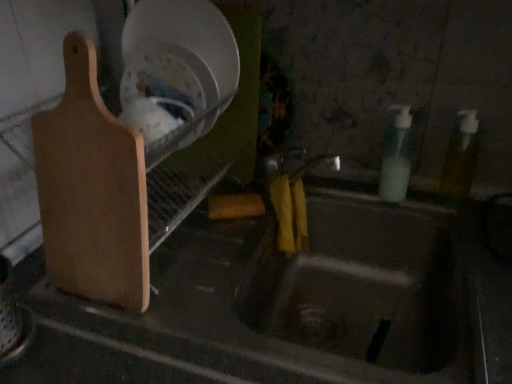
Question: From the image's perspective, is metallic sink at center on light brown wood cutting board at left?

Choices:
 (A) no
 (B) yes

Answer: (A)

Question: Does metallic sink at center appear on the left side of light brown wood cutting board at left?

Choices:
 (A) yes
 (B) no

Answer: (B)

Question: From a real-world perspective, is metallic sink at center physically above light brown wood cutting board at left?

Choices:
 (A) yes
 (B) no

Answer: (B)

Question: Would you say metallic sink at center is a long distance from light brown wood cutting board at left?

Choices:
 (A) no
 (B) yes

Answer: (A)

Question: Would you say metallic sink at center is outside light brown wood cutting board at left?

Choices:
 (A) no
 (B) yes

Answer: (B)

Question: In terms of width, does light brown wood cutting board at left look wider or thinner when compared to translucent plastic soap dispenser at right, which is the first bottle in left-to-right order?

Choices:
 (A) wide
 (B) thin

Answer: (A)

Question: Visually, is light brown wood cutting board at left positioned to the left or to the right of translucent plastic soap dispenser at right, which ranks as the second bottle in right-to-left order?

Choices:
 (A) left
 (B) right

Answer: (A)

Question: Is light brown wood cutting board at left bigger or smaller than translucent plastic soap dispenser at right, which is the first bottle in left-to-right order?

Choices:
 (A) small
 (B) big

Answer: (B)

Question: Is light brown wood cutting board at left inside or outside of translucent plastic soap dispenser at right, which ranks as the second bottle in right-to-left order?

Choices:
 (A) inside
 (B) outside

Answer: (B)

Question: Considering the positions of light brown wood cutting board at left and translucent yellow bottle at right, the 2th bottle when ordered from left to right, in the image, is light brown wood cutting board at left wider or thinner than translucent yellow bottle at right, the 2th bottle when ordered from left to right,?

Choices:
 (A) thin
 (B) wide

Answer: (B)

Question: Is light brown wood cutting board at left bigger or smaller than translucent yellow bottle at right, the 2th bottle when ordered from left to right?

Choices:
 (A) big
 (B) small

Answer: (A)

Question: In the image, is light brown wood cutting board at left on the left side or the right side of translucent yellow bottle at right, the 2th bottle when ordered from left to right?

Choices:
 (A) right
 (B) left

Answer: (B)

Question: From the image's perspective, relative to translucent yellow bottle at right, the first bottle when ordered from right to left, is light brown wood cutting board at left above or below?

Choices:
 (A) below
 (B) above

Answer: (A)

Question: In terms of size, does translucent plastic soap dispenser at right, which is the first bottle in left-to-right order, appear bigger or smaller than translucent yellow bottle at right, the 2th bottle when ordered from left to right?

Choices:
 (A) small
 (B) big

Answer: (B)

Question: Would you say translucent plastic soap dispenser at right, which ranks as the second bottle in right-to-left order, is to the left or to the right of translucent yellow bottle at right, the first bottle when ordered from right to left, in the picture?

Choices:
 (A) right
 (B) left

Answer: (B)